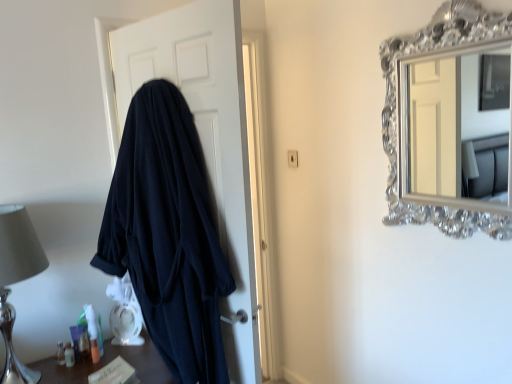
Question: Considering the relative sizes of translucent plastic tube at lower left, positioned as the 1th toiletry in right-to-left order, and translucent plastic toiletries at lower left in the image provided, is translucent plastic tube at lower left, positioned as the 1th toiletry in right-to-left order, shorter than translucent plastic toiletries at lower left?

Choices:
 (A) yes
 (B) no

Answer: (A)

Question: Is translucent plastic tube at lower left, acting as the second toiletry starting from the left, touching translucent plastic toiletries at lower left?

Choices:
 (A) no
 (B) yes

Answer: (A)

Question: Is translucent plastic toiletries at lower left surrounded by translucent plastic tube at lower left, acting as the second toiletry starting from the left?

Choices:
 (A) yes
 (B) no

Answer: (B)

Question: Considering the relative sizes of translucent plastic tube at lower left, acting as the second toiletry starting from the left, and translucent plastic toiletries at lower left in the image provided, is translucent plastic tube at lower left, acting as the second toiletry starting from the left, wider than translucent plastic toiletries at lower left?

Choices:
 (A) no
 (B) yes

Answer: (A)

Question: Would you consider translucent plastic tube at lower left, positioned as the 1th toiletry in right-to-left order, to be distant from translucent plastic toiletries at lower left?

Choices:
 (A) yes
 (B) no

Answer: (B)

Question: From a real-world perspective, does translucent plastic tube at lower left, positioned as the 1th toiletry in right-to-left order, stand above translucent plastic toiletries at lower left?

Choices:
 (A) no
 (B) yes

Answer: (B)

Question: Is the depth of dark blue robe at left greater than that of translucent plastic tube at lower left, positioned as the 1th toiletry in right-to-left order?

Choices:
 (A) no
 (B) yes

Answer: (A)

Question: Considering the relative sizes of dark blue robe at left and translucent plastic tube at lower left, acting as the second toiletry starting from the left, in the image provided, is dark blue robe at left bigger than translucent plastic tube at lower left, acting as the second toiletry starting from the left,?

Choices:
 (A) no
 (B) yes

Answer: (B)

Question: Is dark blue robe at left closer to camera compared to translucent plastic tube at lower left, positioned as the 1th toiletry in right-to-left order?

Choices:
 (A) no
 (B) yes

Answer: (B)

Question: Is dark blue robe at left thinner than translucent plastic tube at lower left, acting as the second toiletry starting from the left?

Choices:
 (A) yes
 (B) no

Answer: (B)

Question: Does dark blue robe at left have a lesser height compared to translucent plastic tube at lower left, positioned as the 1th toiletry in right-to-left order?

Choices:
 (A) no
 (B) yes

Answer: (A)

Question: Would you say dark blue robe at left is a long distance from translucent plastic tube at lower left, positioned as the 1th toiletry in right-to-left order?

Choices:
 (A) yes
 (B) no

Answer: (A)

Question: Does silver metallic table lamp at left have a greater width compared to translucent plastic tube at lower left, positioned as the 1th toiletry in right-to-left order?

Choices:
 (A) yes
 (B) no

Answer: (A)